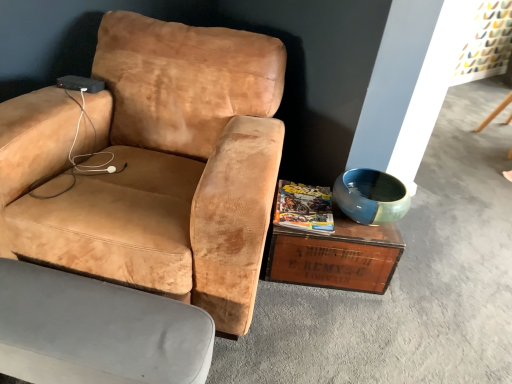
This screenshot has width=512, height=384. Describe the element at coordinates (155, 165) in the screenshot. I see `suede tan chair at center, the second chair from the bottom` at that location.

Based on the photo, what is the approximate height of suede tan chair at center, the 1th chair from the top?

The height of suede tan chair at center, the 1th chair from the top, is 34.03 inches.

Looking at this image, measure the distance between point [314,198] and camera.

The distance of point [314,198] from camera is 1.77 meters.

Image resolution: width=512 pixels, height=384 pixels. Find the location of `matte yellow magazine at center`. matte yellow magazine at center is located at coordinates (304, 207).

In order to click on wooden crate at lower right in this screenshot , I will do `click(336, 255)`.

You are a GUI agent. You are given a task and a screenshot of the screen. Output one action in this format:
    pyautogui.click(x=<x>, y=<y>)
    Task: Click on the suede tan chair at center, the second chair from the bottom
    This screenshot has width=512, height=384.
    Given the screenshot: What is the action you would take?
    pyautogui.click(x=155, y=165)

Considering the relative sizes of wooden crate at lower right and velvet beige armchair at lower left, the 2th chair when ordered from top to bottom, in the image provided, is wooden crate at lower right wider than velvet beige armchair at lower left, the 2th chair when ordered from top to bottom,?

Correct, the width of wooden crate at lower right exceeds that of velvet beige armchair at lower left, the 2th chair when ordered from top to bottom.

Locate an element on the screen. This screenshot has height=384, width=512. coffee table behind the velvet beige armchair at lower left, the 1th chair in the bottom-to-top sequence is located at coordinates (336, 255).

How many degrees apart are the facing directions of wooden crate at lower right and velvet beige armchair at lower left, the 2th chair when ordered from top to bottom?

The angle between the facing direction of wooden crate at lower right and the facing direction of velvet beige armchair at lower left, the 2th chair when ordered from top to bottom, is 9.78 degrees.

Is matte yellow magazine at center facing away from suede tan chair at center, the second chair from the bottom?

matte yellow magazine at center is not turned away from suede tan chair at center, the second chair from the bottom.

Are matte yellow magazine at center and suede tan chair at center, the 1th chair from the top, far apart?

They are positioned close to each other.

Is point (307, 230) more distant than point (88, 103)?

No, (307, 230) is in front of (88, 103).

Can you confirm if matte yellow magazine at center is bigger than suede tan chair at center, the 1th chair from the top?

No, matte yellow magazine at center is not bigger than suede tan chair at center, the 1th chair from the top.

Which object is closer to the camera, suede tan chair at center, the 1th chair from the top, or matte yellow magazine at center?

suede tan chair at center, the 1th chair from the top, is more forward.

From a real-world perspective, is suede tan chair at center, the 1th chair from the top, positioned above or below matte yellow magazine at center?

suede tan chair at center, the 1th chair from the top, is above matte yellow magazine at center.

Which point is more distant from viewer, [151,161] or [306,214]?

The point [306,214] is more distant.

Would you say suede tan chair at center, the 1th chair from the top, is inside or outside matte yellow magazine at center?

suede tan chair at center, the 1th chair from the top, is spatially situated outside matte yellow magazine at center.

Is suede tan chair at center, the 1th chair from the top, shorter than wooden crate at lower right?

No.

From a real-world perspective, between suede tan chair at center, the second chair from the bottom, and wooden crate at lower right, who is vertically higher?

In real-world perspective, suede tan chair at center, the second chair from the bottom, is above.

Consider the image. Between suede tan chair at center, the second chair from the bottom, and wooden crate at lower right, which one appears on the left side from the viewer's perspective?

suede tan chair at center, the second chair from the bottom.

Is wooden crate at lower right oriented away from suede tan chair at center, the second chair from the bottom?

No, wooden crate at lower right's orientation is not away from suede tan chair at center, the second chair from the bottom.

Is wooden crate at lower right in contact with suede tan chair at center, the 1th chair from the top?

wooden crate at lower right and suede tan chair at center, the 1th chair from the top, are not in contact.

From the image's perspective, is wooden crate at lower right above or below suede tan chair at center, the second chair from the bottom?

Based on their image positions, wooden crate at lower right is located beneath suede tan chair at center, the second chair from the bottom.

Does point (323, 258) lie in front of point (81, 234)?

No, (323, 258) is further to viewer.

Is velvet beige armchair at lower left, the 1th chair in the bottom-to-top sequence, taller than suede tan chair at center, the 1th chair from the top?

In fact, velvet beige armchair at lower left, the 1th chair in the bottom-to-top sequence, may be shorter than suede tan chair at center, the 1th chair from the top.

Is velvet beige armchair at lower left, the 2th chair when ordered from top to bottom, to the left or to the right of suede tan chair at center, the second chair from the bottom, in the image?

In the image, velvet beige armchair at lower left, the 2th chair when ordered from top to bottom, appears on the left side of suede tan chair at center, the second chair from the bottom.

In the image, is velvet beige armchair at lower left, the 1th chair in the bottom-to-top sequence, positioned in front of or behind suede tan chair at center, the second chair from the bottom?

velvet beige armchair at lower left, the 1th chair in the bottom-to-top sequence, is behind suede tan chair at center, the second chair from the bottom.

Looking at the image, does velvet beige armchair at lower left, the 2th chair when ordered from top to bottom, seem bigger or smaller compared to suede tan chair at center, the second chair from the bottom?

In the image, velvet beige armchair at lower left, the 2th chair when ordered from top to bottom, appears to be smaller than suede tan chair at center, the second chair from the bottom.

Which is in front, matte yellow magazine at center or wooden crate at lower right?

matte yellow magazine at center is closer to the camera.

Is matte yellow magazine at center bigger or smaller than wooden crate at lower right?

Considering their sizes, matte yellow magazine at center takes up less space than wooden crate at lower right.

Which object is thinner, matte yellow magazine at center or wooden crate at lower right?

Thinner between the two is matte yellow magazine at center.

Is wooden crate at lower right at the back of matte yellow magazine at center?

matte yellow magazine at center does not have its back to wooden crate at lower right.

At what (x,y) coordinates should I click in order to perform the action: click on coffee table above the velvet beige armchair at lower left, the 2th chair when ordered from top to bottom (from the image's perspective). Please return your answer as a coordinate pair (x, y). Image resolution: width=512 pixels, height=384 pixels. Looking at the image, I should click on (336, 255).

Locate an element on the screen. Image resolution: width=512 pixels, height=384 pixels. magazine that appears behind the suede tan chair at center, the 1th chair from the top is located at coordinates (304, 207).

Estimate the real-world distances between objects in this image. Which object is further from suede tan chair at center, the 1th chair from the top, blue glossy bowl at right or wooden crate at lower right?

Based on the image, blue glossy bowl at right appears to be further to suede tan chair at center, the 1th chair from the top.

When comparing their distances from velvet beige armchair at lower left, the 1th chair in the bottom-to-top sequence, does blue glossy bowl at right or wooden crate at lower right seem further?

Based on the image, blue glossy bowl at right appears to be further to velvet beige armchair at lower left, the 1th chair in the bottom-to-top sequence.

From the image, which object appears to be farther from matte yellow magazine at center, wooden crate at lower right or blue glossy bowl at right?

blue glossy bowl at right is positioned further to the anchor matte yellow magazine at center.

Estimate the real-world distances between objects in this image. Which object is further from wooden crate at lower right, suede tan chair at center, the 1th chair from the top, or matte yellow magazine at center?

suede tan chair at center, the 1th chair from the top, lies further to wooden crate at lower right than the other object.

Based on their spatial positions, is blue glossy bowl at right or matte yellow magazine at center closer to wooden crate at lower right?

The object closer to wooden crate at lower right is matte yellow magazine at center.

From the image, which object appears to be farther from velvet beige armchair at lower left, the 2th chair when ordered from top to bottom, matte yellow magazine at center or suede tan chair at center, the second chair from the bottom?

matte yellow magazine at center lies further to velvet beige armchair at lower left, the 2th chair when ordered from top to bottom, than the other object.

Estimate the real-world distances between objects in this image. Which object is further from blue glossy bowl at right, velvet beige armchair at lower left, the 2th chair when ordered from top to bottom, or suede tan chair at center, the second chair from the bottom?

Among the two, velvet beige armchair at lower left, the 2th chair when ordered from top to bottom, is located further to blue glossy bowl at right.

When comparing their distances from velvet beige armchair at lower left, the 1th chair in the bottom-to-top sequence, does matte yellow magazine at center or blue glossy bowl at right seem closer?

matte yellow magazine at center.

I want to click on chair located between velvet beige armchair at lower left, the 2th chair when ordered from top to bottom, and matte yellow magazine at center in the left-right direction, so click(155, 165).

The height and width of the screenshot is (384, 512). In order to click on coffee table between velvet beige armchair at lower left, the 1th chair in the bottom-to-top sequence, and blue glossy bowl at right in this screenshot , I will do `click(336, 255)`.

In order to click on coffee table between suede tan chair at center, the second chair from the bottom, and blue glossy bowl at right in this screenshot , I will do `click(336, 255)`.

Where is `magazine between suede tan chair at center, the 1th chair from the top, and wooden crate at lower right`? The width and height of the screenshot is (512, 384). magazine between suede tan chair at center, the 1th chair from the top, and wooden crate at lower right is located at coordinates (304, 207).